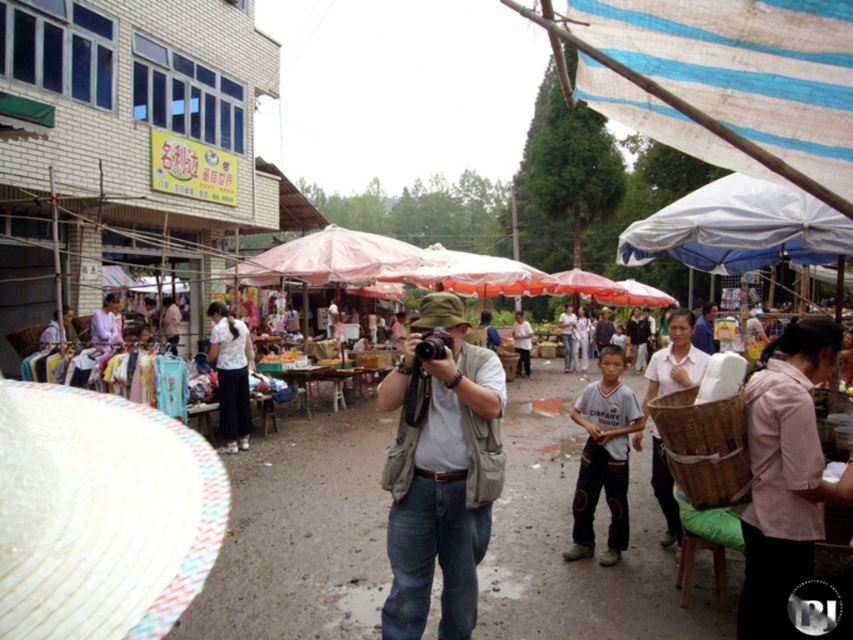
You are a photographer at the market and want to take a photo of two people wearing the pink striped shirt at lower right and the white cotton shirt at center. Which person should stand closer to the camera to ensure both appear the same height in the photo?

The pink striped shirt at lower right is shorter than the white cotton shirt at center. To make them appear the same height in the photo, the person in the pink striped shirt at lower right should stand closer to the camera.

You are a photographer at the market and want to capture both the pink striped shirt at lower right and the pink fabric umbrella at center in the same frame. Based on their positions, can you tell which object is closer to the right edge of your camera view?

The pink striped shirt at lower right is to the right of the pink fabric umbrella at center, so the pink striped shirt at lower right is closer to the right edge of the camera view.

You are a photographer at the market and want to capture the pink striped shirt at lower right in your photo. Where should you position your camera to ensure it appears in the frame?

Position your camera so that it captures the area at point 0.741 on the horizontal axis and 0.920 on the vertical axis, where the pink striped shirt at lower right is located.